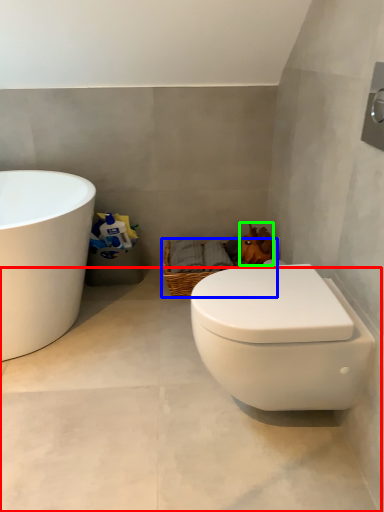
Question: Which is nearer to the concrete (highlighted by a red box)? basket (highlighted by a blue box) or animal (highlighted by a green box).

Choices:
 (A) basket
 (B) animal

Answer: (A)